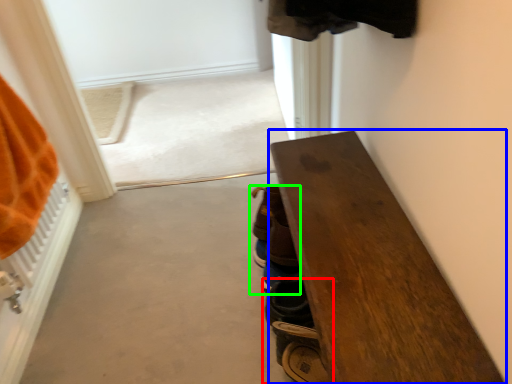
Question: Estimate the real-world distances between objects in this image. Which object is farther from footwear (highlighted by a red box), furniture (highlighted by a blue box) or footwear (highlighted by a green box)?

Choices:
 (A) furniture
 (B) footwear

Answer: (A)